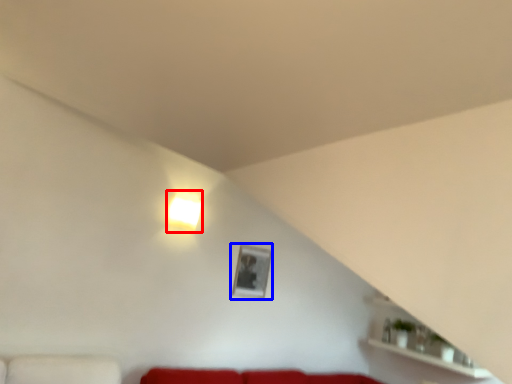
Question: Which of the following is the farthest to the observer, lamp (highlighted by a red box) or picture frame (highlighted by a blue box)?

Choices:
 (A) lamp
 (B) picture frame

Answer: (B)